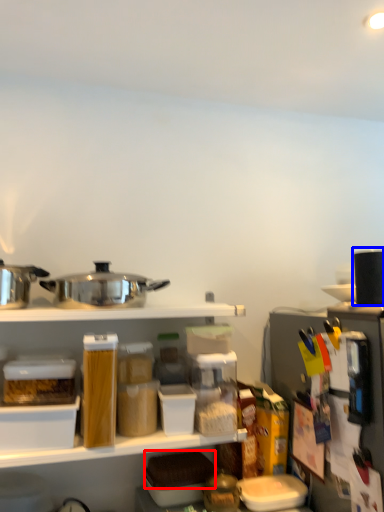
Question: Which object is closer to the camera taking this photo, food (highlighted by a red box) or appliance (highlighted by a blue box)?

Choices:
 (A) food
 (B) appliance

Answer: (B)